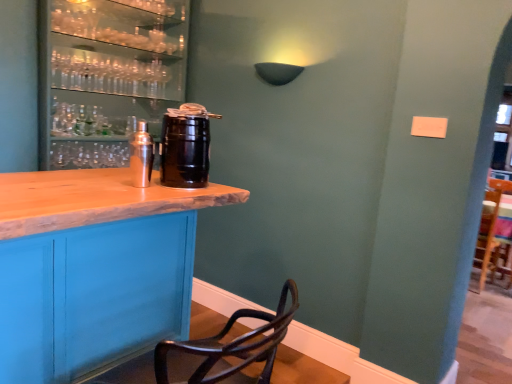
Question: Considering the positions of shiny silver shaker at center, the first beverage in the left-to-right sequence, and black matte keg at center, the second beverage positioned from the left, in the image, is shiny silver shaker at center, the first beverage in the left-to-right sequence, wider or thinner than black matte keg at center, the second beverage positioned from the left,?

Choices:
 (A) wide
 (B) thin

Answer: (B)

Question: Based on their sizes in the image, would you say shiny silver shaker at center, the first beverage in the left-to-right sequence, is bigger or smaller than black matte keg at center, the second beverage positioned from the left?

Choices:
 (A) small
 (B) big

Answer: (A)

Question: Estimate the real-world distances between objects in this image. Which object is farther from the shiny silver shaker at center, which is counted as the second beverage, starting from the right?

Choices:
 (A) black matte keg at center, the first beverage from the right
 (B) matte black barrel at left

Answer: (B)

Question: Estimate the real-world distances between objects in this image. Which object is farther from the black matte keg at center, the second beverage positioned from the left?

Choices:
 (A) matte black barrel at left
 (B) shiny silver shaker at center, the first beverage in the left-to-right sequence

Answer: (A)